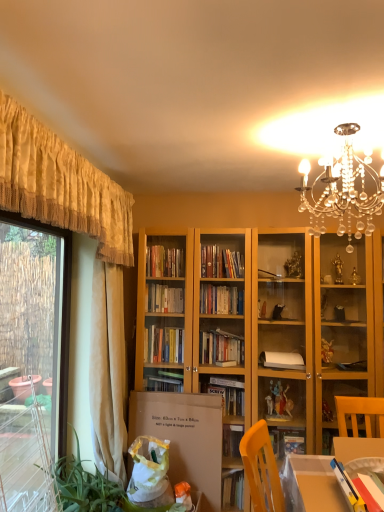
Describe the element at coordinates (184, 437) in the screenshot. This screenshot has width=384, height=512. I see `cardboard box at lower left` at that location.

The image size is (384, 512). Describe the element at coordinates (32, 364) in the screenshot. I see `transparent glass window at left` at that location.

What do you see at coordinates (61, 185) in the screenshot?
I see `yellow fabric curtain at upper left, the second curtain viewed from the back` at bounding box center [61, 185].

Describe the element at coordinates (108, 370) in the screenshot. I see `beige fabric curtain at left, the first curtain from the back` at that location.

The width and height of the screenshot is (384, 512). Find the location of `beige fabric curtain at left, the first curtain from the back`. beige fabric curtain at left, the first curtain from the back is located at coordinates (108, 370).

What is the approximate height of wooden table at lower right?

wooden table at lower right is 12.56 inches tall.

In order to click on clear crystal chandelier at upper center in this screenshot , I will do `click(343, 190)`.

Considering the relative sizes of green leafy plant at lower left and beige fabric curtain at left, the first curtain from the back, in the image provided, is green leafy plant at lower left shorter than beige fabric curtain at left, the first curtain from the back,?

Correct, green leafy plant at lower left is not as tall as beige fabric curtain at left, the first curtain from the back.

Is green leafy plant at lower left touching beige fabric curtain at left, the first curtain from the back?

green leafy plant at lower left is not next to beige fabric curtain at left, the first curtain from the back, and they're not touching.

From the image's perspective, is green leafy plant at lower left above or below beige fabric curtain at left, the first curtain from the back?

From the image's perspective, green leafy plant at lower left appears below beige fabric curtain at left, the first curtain from the back.

Is yellow fabric curtain at upper left, the second curtain viewed from the back, smaller than clear crystal chandelier at upper center?

No, yellow fabric curtain at upper left, the second curtain viewed from the back, is not smaller than clear crystal chandelier at upper center.

Which object is wider, yellow fabric curtain at upper left, the first curtain viewed from the front, or clear crystal chandelier at upper center?

With larger width is clear crystal chandelier at upper center.

Is yellow fabric curtain at upper left, the first curtain viewed from the front, inside the boundaries of clear crystal chandelier at upper center, or outside?

yellow fabric curtain at upper left, the first curtain viewed from the front, is located beyond the bounds of clear crystal chandelier at upper center.

From the image's perspective, which is above, yellow fabric curtain at upper left, the first curtain viewed from the front, or clear crystal chandelier at upper center?

clear crystal chandelier at upper center is shown above in the image.

Is green leafy plant at lower left directly adjacent to transparent glass window at left?

There is a gap between green leafy plant at lower left and transparent glass window at left.

From a real-world perspective, does green leafy plant at lower left sit lower than transparent glass window at left?

Yes, from a real-world perspective, green leafy plant at lower left is beneath transparent glass window at left.

Considering the sizes of green leafy plant at lower left and transparent glass window at left in the image, is green leafy plant at lower left taller or shorter than transparent glass window at left?

Considering their sizes, green leafy plant at lower left has less height than transparent glass window at left.

From the image's perspective, who appears lower, green leafy plant at lower left or transparent glass window at left?

green leafy plant at lower left is shown below in the image.

Measure the distance between clear crystal chandelier at upper center and green leafy plant at lower left.

clear crystal chandelier at upper center and green leafy plant at lower left are 6.75 feet apart from each other.

You are a GUI agent. You are given a task and a screenshot of the screen. Output one action in this format:
    pyautogui.click(x=<x>, y=<y>)
    Task: Click on the lamp that is in front of the green leafy plant at lower left
    
    Given the screenshot: What is the action you would take?
    pyautogui.click(x=343, y=190)

Considering the sizes of clear crystal chandelier at upper center and green leafy plant at lower left in the image, is clear crystal chandelier at upper center wider or thinner than green leafy plant at lower left?

Considering their sizes, clear crystal chandelier at upper center looks slimmer than green leafy plant at lower left.

In the scene shown: Does clear crystal chandelier at upper center have a lesser height compared to green leafy plant at lower left?

Correct, clear crystal chandelier at upper center is not as tall as green leafy plant at lower left.

From the image's perspective, between yellow fabric curtain at upper left, the second curtain viewed from the back, and beige fabric curtain at left, the first curtain from the back, which one is located above?

yellow fabric curtain at upper left, the second curtain viewed from the back, appears higher in the image.

From a real-world perspective, is yellow fabric curtain at upper left, the first curtain viewed from the front, physically located above or below beige fabric curtain at left, which ranks as the second curtain in front-to-back order?

Clearly, from a real-world perspective, yellow fabric curtain at upper left, the first curtain viewed from the front, is above beige fabric curtain at left, which ranks as the second curtain in front-to-back order.

Between point (83, 178) and point (110, 365), which one is positioned in front?

Point (83, 178)

Is yellow fabric curtain at upper left, the first curtain viewed from the front, further to camera compared to transparent glass window at left?

No, it is not.

Is yellow fabric curtain at upper left, the second curtain viewed from the back, shorter than transparent glass window at left?

Correct, yellow fabric curtain at upper left, the second curtain viewed from the back, is not as tall as transparent glass window at left.

From the image's perspective, between yellow fabric curtain at upper left, the first curtain viewed from the front, and transparent glass window at left, which one is located above?

yellow fabric curtain at upper left, the first curtain viewed from the front, from the image's perspective.

Who is bigger, yellow fabric curtain at upper left, the first curtain viewed from the front, or transparent glass window at left?

With larger size is transparent glass window at left.

How much distance is there between wooden table at lower right and transparent glass window at left?

A distance of 1.72 meters exists between wooden table at lower right and transparent glass window at left.

Does wooden table at lower right have a lesser width compared to transparent glass window at left?

Incorrect, the width of wooden table at lower right is not less than that of transparent glass window at left.

From the image's perspective, which is below, wooden table at lower right or transparent glass window at left?

wooden table at lower right, from the image's perspective.

Find the location of a particular element. The image size is (384, 512). plant that appears on the left of beige fabric curtain at left, the first curtain from the back is located at coordinates (x=85, y=487).

I want to click on the 1st curtain below when counting from the clear crystal chandelier at upper center (from the image's perspective), so click(61, 185).

When comparing their distances from beige fabric curtain at left, the first curtain from the back, does green leafy plant at lower left or yellow fabric curtain at upper left, the second curtain viewed from the back, seem closer?

green leafy plant at lower left is closer to beige fabric curtain at left, the first curtain from the back.

Estimate the real-world distances between objects in this image. Which object is further from clear crystal chandelier at upper center, yellow fabric curtain at upper left, the first curtain viewed from the front, or beige fabric curtain at left, the first curtain from the back?

beige fabric curtain at left, the first curtain from the back, lies further to clear crystal chandelier at upper center than the other object.

Considering their positions, is green leafy plant at lower left positioned further to transparent glass window at left than yellow fabric curtain at upper left, the first curtain viewed from the front?

yellow fabric curtain at upper left, the first curtain viewed from the front, is further to transparent glass window at left.

From the image, which object appears to be farther from beige fabric curtain at left, the first curtain from the back, green leafy plant at lower left or clear crystal chandelier at upper center?

Among the two, clear crystal chandelier at upper center is located further to beige fabric curtain at left, the first curtain from the back.

Looking at the image, which one is located closer to wooden table at lower right, clear crystal chandelier at upper center or yellow fabric curtain at upper left, the first curtain viewed from the front?

The object closer to wooden table at lower right is clear crystal chandelier at upper center.

Consider the image. When comparing their distances from yellow fabric curtain at upper left, the first curtain viewed from the front, does beige fabric curtain at left, the first curtain from the back, or clear crystal chandelier at upper center seem further?

clear crystal chandelier at upper center lies further to yellow fabric curtain at upper left, the first curtain viewed from the front, than the other object.

When comparing their distances from yellow fabric curtain at upper left, the first curtain viewed from the front, does clear crystal chandelier at upper center or wooden table at lower right seem closer?

clear crystal chandelier at upper center is positioned closer to the anchor yellow fabric curtain at upper left, the first curtain viewed from the front.

Which object lies further to the anchor point clear crystal chandelier at upper center, yellow fabric curtain at upper left, the second curtain viewed from the back, or transparent glass window at left?

Among the two, transparent glass window at left is located further to clear crystal chandelier at upper center.

This screenshot has width=384, height=512. Find the location of `plant between transparent glass window at left and clear crystal chandelier at upper center from left to right`. plant between transparent glass window at left and clear crystal chandelier at upper center from left to right is located at coordinates (85, 487).

Where is `plant between clear crystal chandelier at upper center and cardboard box at lower left in the up-down direction`? plant between clear crystal chandelier at upper center and cardboard box at lower left in the up-down direction is located at coordinates (85, 487).

Where is `plant between wooden table at lower right and beige fabric curtain at left, the first curtain from the back, from front to back`? Image resolution: width=384 pixels, height=512 pixels. plant between wooden table at lower right and beige fabric curtain at left, the first curtain from the back, from front to back is located at coordinates (85, 487).

This screenshot has width=384, height=512. In order to click on table between yellow fabric curtain at upper left, the second curtain viewed from the back, and clear crystal chandelier at upper center from left to right in this screenshot , I will do `click(311, 485)`.